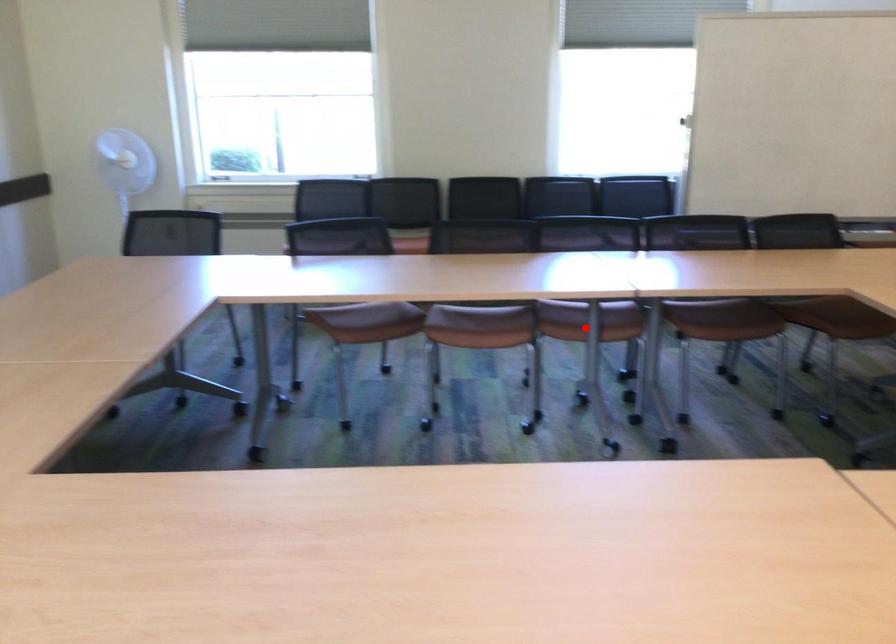
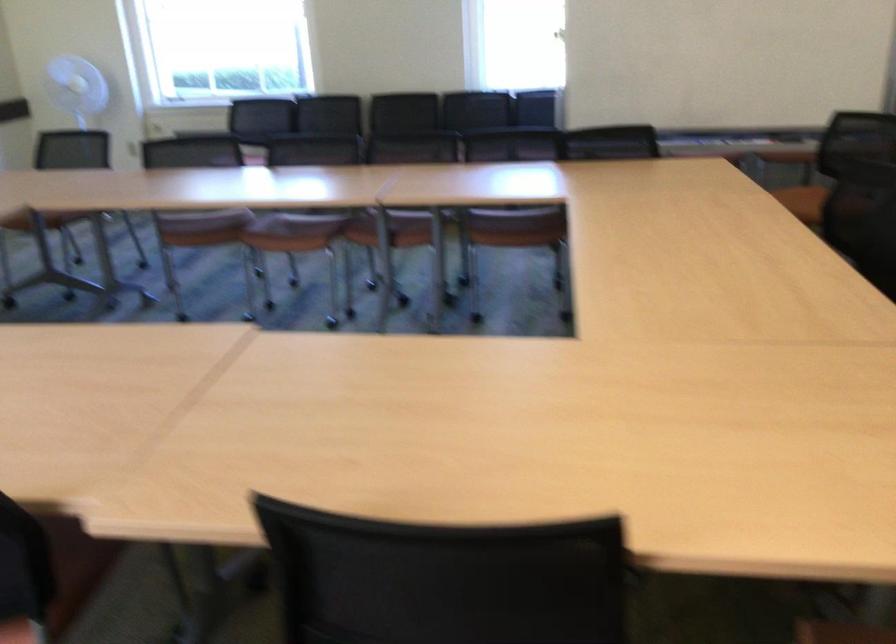
Find the pixel in the second image that matches the highlighted location in the first image.

(391, 230)